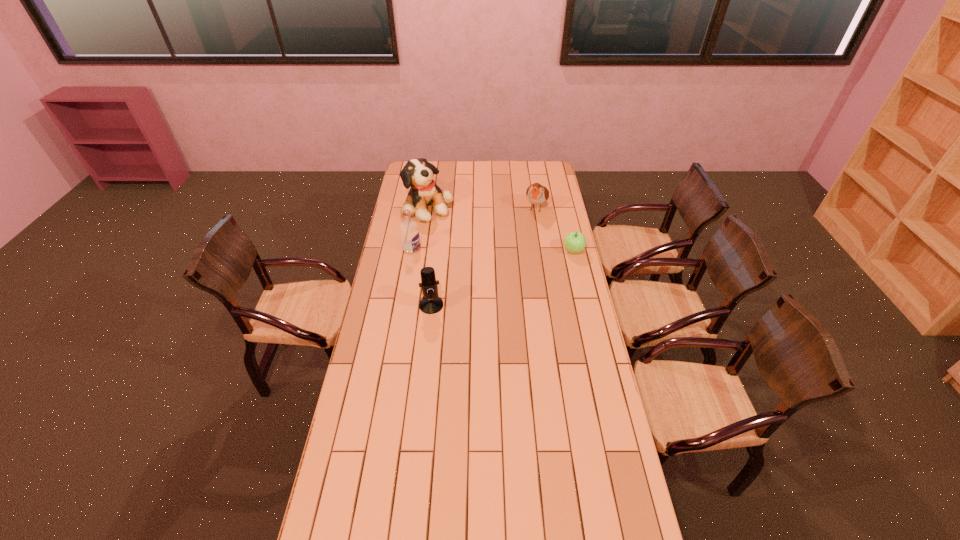
Where is `the nearest object`? The height and width of the screenshot is (540, 960). the nearest object is located at coordinates (430, 303).

Identify the location of the rightmost object. This screenshot has height=540, width=960. (574, 242).

Where is `the shortest object`? The width and height of the screenshot is (960, 540). the shortest object is located at coordinates tap(574, 242).

I want to click on bird, so click(537, 194).

I want to click on vodka, so click(409, 232).

Identify the location of the tallest object. (418, 173).

Image resolution: width=960 pixels, height=540 pixels. I want to click on free space located 0.250m on the stand of the microphone, so click(x=425, y=363).

Find the location of a particular element. This screenshot has width=960, height=540. vacant area situated on the front of the shortest object is located at coordinates (589, 321).

I want to click on free space located 0.170m at the face of the second object from right to left, so click(x=526, y=237).

Where is `vacant space located at the face of the second object from right to left`? This screenshot has height=540, width=960. vacant space located at the face of the second object from right to left is located at coordinates (519, 252).